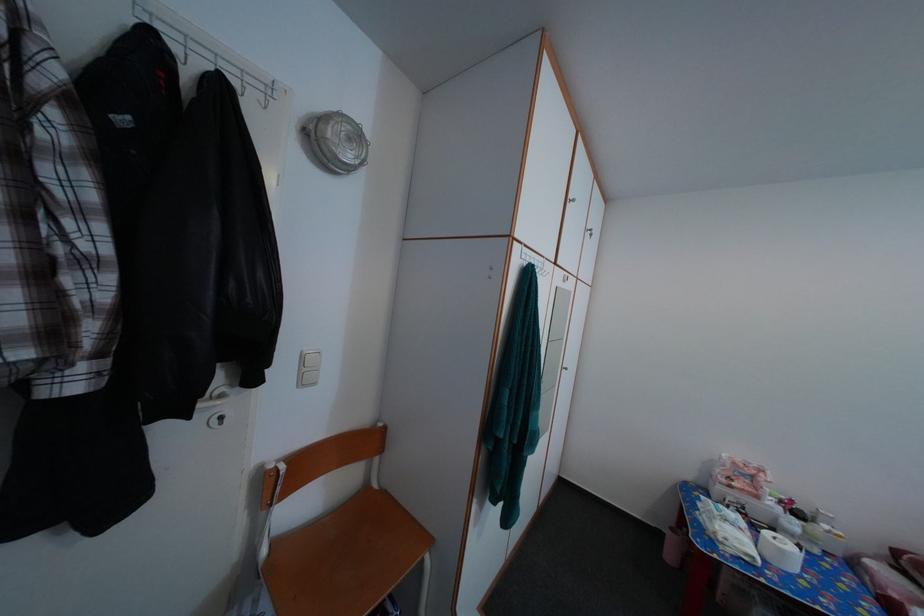
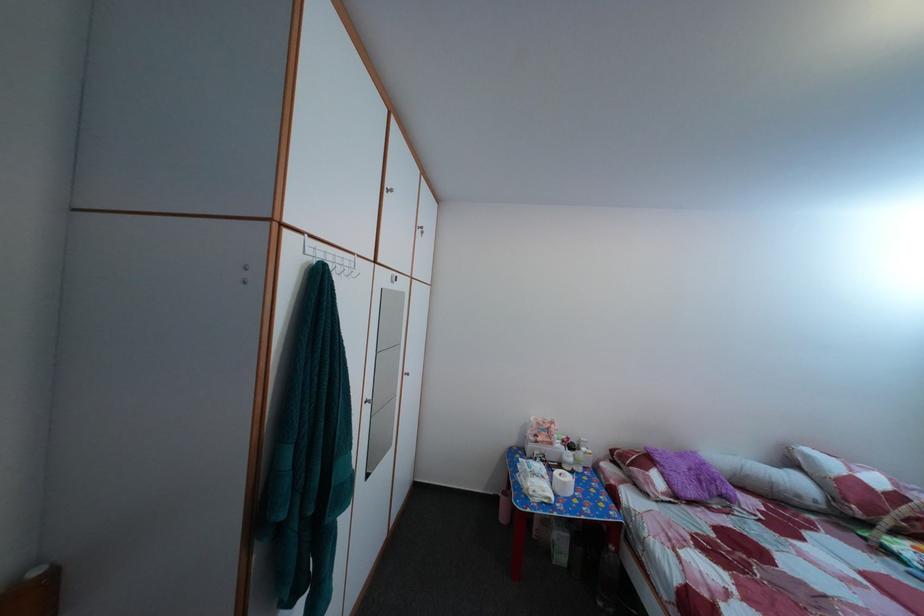
Where in the second image is the point corresponding to [801,509] from the first image?

(578, 447)